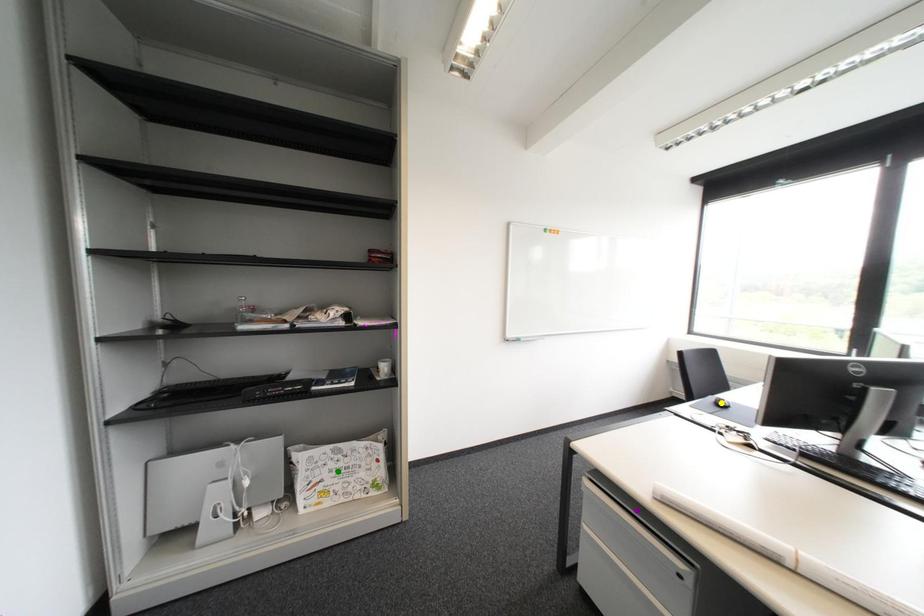
Order these from nearest to farthest:
green point
purple point
yellow point

purple point → green point → yellow point